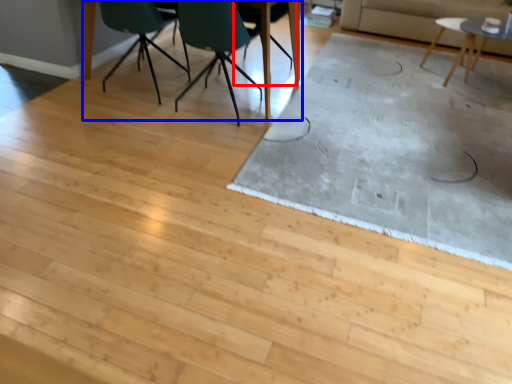
Question: Which of the following is the closest to the observer, chair (highlighted by a red box) or table (highlighted by a blue box)?

Choices:
 (A) chair
 (B) table

Answer: (B)